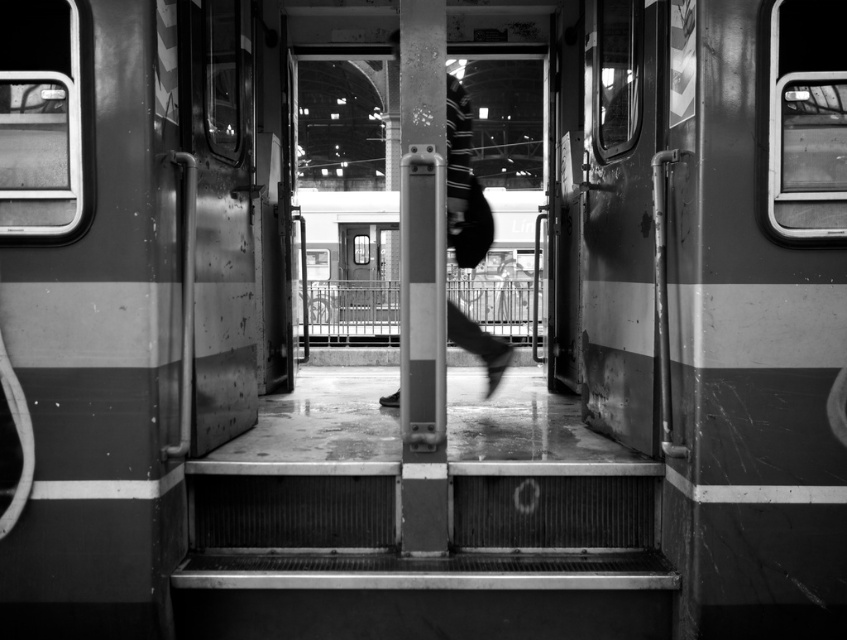
Question: Which point is farther to the camera?

Choices:
 (A) black fabric bag at center
 (B) metallic silver railing at center

Answer: (B)

Question: Does metallic silver railing at center have a greater width compared to black fabric bag at center?

Choices:
 (A) yes
 (B) no

Answer: (A)

Question: Does metallic silver railing at center appear on the right side of black fabric bag at center?

Choices:
 (A) no
 (B) yes

Answer: (A)

Question: Is metallic silver railing at center to the left of black fabric bag at center from the viewer's perspective?

Choices:
 (A) yes
 (B) no

Answer: (A)

Question: Among these objects, which one is farthest from the camera?

Choices:
 (A) metallic silver railing at center
 (B) black fabric bag at center

Answer: (A)